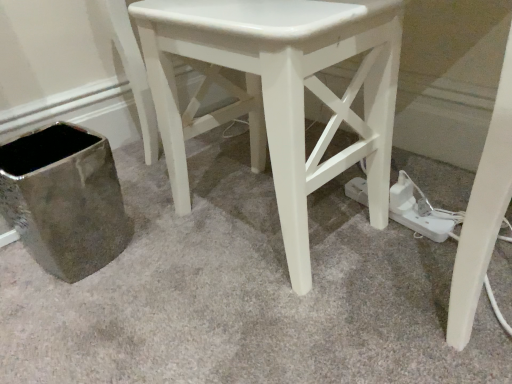
Question: Considering the relative sizes of white plastic plug at lower right and white glossy stool at center in the image provided, is white plastic plug at lower right wider than white glossy stool at center?

Choices:
 (A) yes
 (B) no

Answer: (B)

Question: Is white glossy stool at center surrounded by white plastic plug at lower right?

Choices:
 (A) no
 (B) yes

Answer: (A)

Question: From the image's perspective, would you say white plastic plug at lower right is positioned over white glossy stool at center?

Choices:
 (A) no
 (B) yes

Answer: (A)

Question: Considering the relative sizes of white plastic plug at lower right and white glossy stool at center in the image provided, is white plastic plug at lower right smaller than white glossy stool at center?

Choices:
 (A) no
 (B) yes

Answer: (B)

Question: Are white plastic plug at lower right and white glossy stool at center located far from each other?

Choices:
 (A) yes
 (B) no

Answer: (B)

Question: From a real-world perspective, is white plastic plug at lower right under white glossy stool at center?

Choices:
 (A) no
 (B) yes

Answer: (B)

Question: Considering the relative sizes of white glossy stool at center and white plastic plug at lower right in the image provided, is white glossy stool at center shorter than white plastic plug at lower right?

Choices:
 (A) yes
 (B) no

Answer: (B)

Question: Is white glossy stool at center bigger than white plastic plug at lower right?

Choices:
 (A) no
 (B) yes

Answer: (B)

Question: From a real-world perspective, is white glossy stool at center located beneath white plastic plug at lower right?

Choices:
 (A) yes
 (B) no

Answer: (B)

Question: Considering the relative sizes of white glossy stool at center and white plastic plug at lower right in the image provided, is white glossy stool at center wider than white plastic plug at lower right?

Choices:
 (A) yes
 (B) no

Answer: (A)

Question: Does white glossy stool at center appear on the left side of white plastic plug at lower right?

Choices:
 (A) no
 (B) yes

Answer: (B)

Question: Are white glossy stool at center and white plastic plug at lower right located far from each other?

Choices:
 (A) no
 (B) yes

Answer: (A)

Question: Relative to white glossy stool at center, is white plastic plug at lower right in front or behind?

Choices:
 (A) behind
 (B) front

Answer: (A)